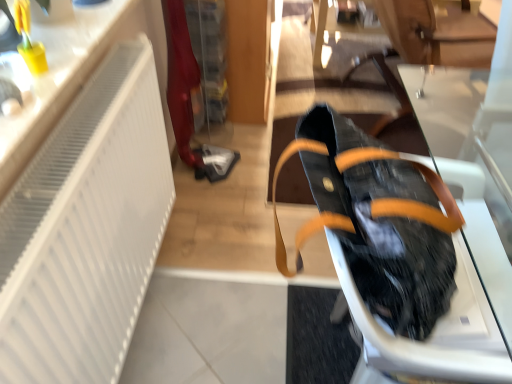
This screenshot has height=384, width=512. I want to click on free space above white matte radiator at left (from a real-world perspective), so click(x=84, y=120).